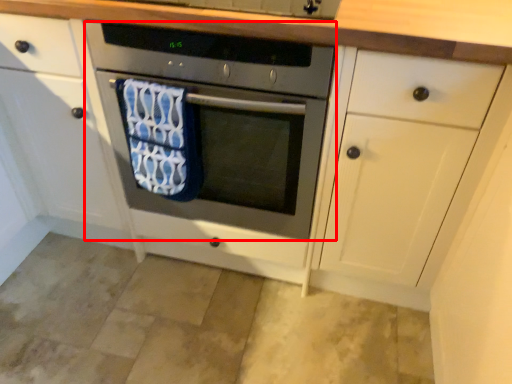
Question: From the image's perspective, what is the correct spatial positioning of oven (annotated by the red box) in reference to beach towel?

Choices:
 (A) above
 (B) below

Answer: (A)